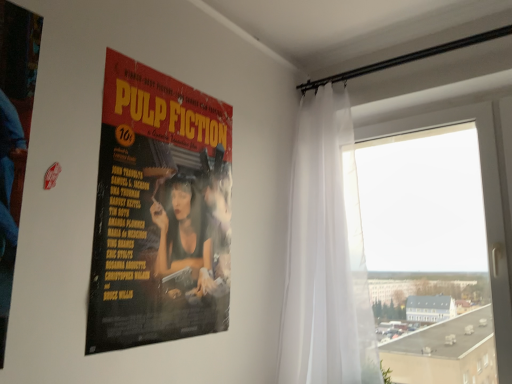
Question: Is there a large distance between matte paper poster at center and white sheer curtain at right?

Choices:
 (A) yes
 (B) no

Answer: (B)

Question: Is matte paper poster at center oriented away from white sheer curtain at right?

Choices:
 (A) no
 (B) yes

Answer: (A)

Question: Is matte paper poster at center positioned beyond the bounds of white sheer curtain at right?

Choices:
 (A) yes
 (B) no

Answer: (A)

Question: Is matte paper poster at center positioned behind white sheer curtain at right?

Choices:
 (A) no
 (B) yes

Answer: (A)

Question: Is matte paper poster at center at the left side of white sheer curtain at right?

Choices:
 (A) yes
 (B) no

Answer: (A)

Question: Does point (500, 160) appear closer or farther from the camera than point (221, 115)?

Choices:
 (A) closer
 (B) farther

Answer: (B)

Question: Considering the positions of transparent glass window at right and matte paper poster at center in the image, is transparent glass window at right bigger or smaller than matte paper poster at center?

Choices:
 (A) small
 (B) big

Answer: (B)

Question: Considering the positions of transparent glass window at right and matte paper poster at center in the image, is transparent glass window at right wider or thinner than matte paper poster at center?

Choices:
 (A) wide
 (B) thin

Answer: (A)

Question: Considering the positions of transparent glass window at right and matte paper poster at center in the image, is transparent glass window at right taller or shorter than matte paper poster at center?

Choices:
 (A) tall
 (B) short

Answer: (A)

Question: In terms of width, does transparent glass window at right look wider or thinner when compared to white sheer curtain at right?

Choices:
 (A) wide
 (B) thin

Answer: (B)

Question: Is transparent glass window at right inside or outside of white sheer curtain at right?

Choices:
 (A) outside
 (B) inside

Answer: (A)

Question: Based on their sizes in the image, would you say transparent glass window at right is bigger or smaller than white sheer curtain at right?

Choices:
 (A) small
 (B) big

Answer: (A)

Question: From a real-world perspective, is transparent glass window at right physically located above or below white sheer curtain at right?

Choices:
 (A) below
 (B) above

Answer: (A)

Question: Is white sheer curtain at right wider or thinner than transparent glass window at right?

Choices:
 (A) wide
 (B) thin

Answer: (A)

Question: Considering the positions of white sheer curtain at right and transparent glass window at right in the image, is white sheer curtain at right bigger or smaller than transparent glass window at right?

Choices:
 (A) small
 (B) big

Answer: (B)